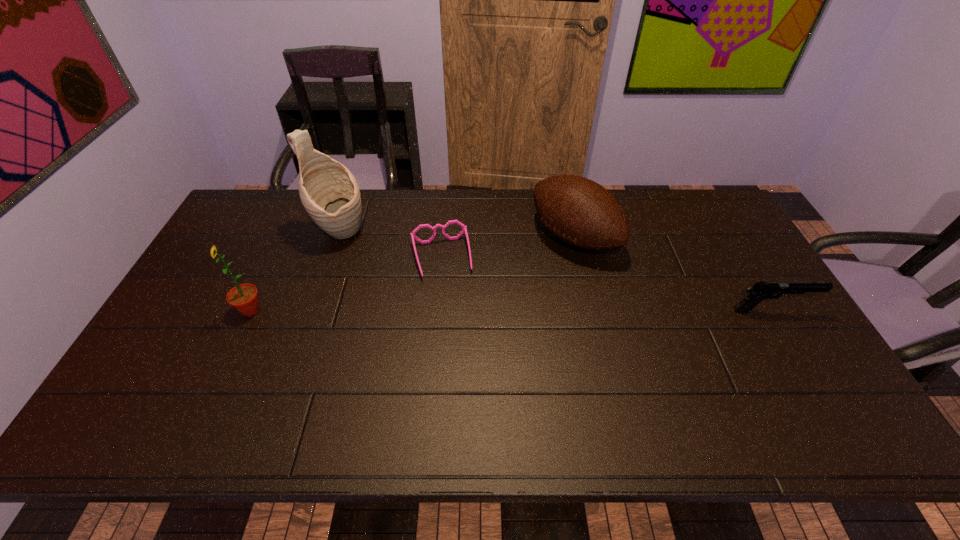
The image size is (960, 540). In order to click on sunflower in this screenshot , I will do `click(244, 298)`.

The width and height of the screenshot is (960, 540). In order to click on gun in this screenshot , I will do `click(760, 291)`.

I want to click on the fourth tallest object, so click(x=760, y=291).

I want to click on the shortest object, so click(464, 228).

Identify the location of spectacles. The width and height of the screenshot is (960, 540). (464, 228).

This screenshot has height=540, width=960. What are the coordinates of `football` in the screenshot? It's located at (582, 213).

At what (x,y) coordinates should I click in order to perform the action: click on the third tallest object. Please return your answer as a coordinate pair (x, y). Looking at the image, I should click on (582, 213).

At what (x,y) coordinates should I click in order to perform the action: click on pitcher. Please return your answer as a coordinate pair (x, y). This screenshot has height=540, width=960. Looking at the image, I should click on (329, 192).

The height and width of the screenshot is (540, 960). Identify the location of the fourth object from right to left. (329, 192).

The height and width of the screenshot is (540, 960). Identify the location of vacant point located 0.070m on the face of the leftmost object. (211, 310).